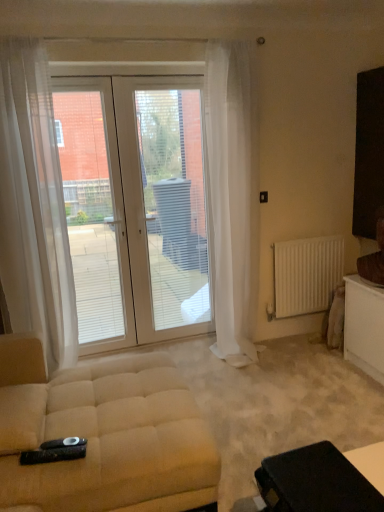
Question: Is black leather table at lower right closer to camera compared to white glass door at center?

Choices:
 (A) no
 (B) yes

Answer: (B)

Question: From the image's perspective, is black leather table at lower right on top of white glass door at center?

Choices:
 (A) yes
 (B) no

Answer: (B)

Question: Is black leather table at lower right oriented towards white glass door at center?

Choices:
 (A) no
 (B) yes

Answer: (A)

Question: From a real-world perspective, is black leather table at lower right below white glass door at center?

Choices:
 (A) no
 (B) yes

Answer: (B)

Question: From the image's perspective, is black leather table at lower right located beneath white glass door at center?

Choices:
 (A) yes
 (B) no

Answer: (A)

Question: Is black leather table at lower right at the right side of white glass door at center?

Choices:
 (A) no
 (B) yes

Answer: (B)

Question: From the image's perspective, is white matte radiator at right beneath white glass door at center?

Choices:
 (A) no
 (B) yes

Answer: (B)

Question: Is the position of white matte radiator at right more distant than that of white glass door at center?

Choices:
 (A) no
 (B) yes

Answer: (B)

Question: Could white glass door at center be considered to be inside white matte radiator at right?

Choices:
 (A) yes
 (B) no

Answer: (B)

Question: Is white matte radiator at right shorter than white glass door at center?

Choices:
 (A) yes
 (B) no

Answer: (A)

Question: Is white matte radiator at right smaller than white glass door at center?

Choices:
 (A) no
 (B) yes

Answer: (B)

Question: Is white matte radiator at right not close to white glass door at center?

Choices:
 (A) no
 (B) yes

Answer: (A)

Question: Is white glass door at center bigger than white matte radiator at right?

Choices:
 (A) yes
 (B) no

Answer: (A)